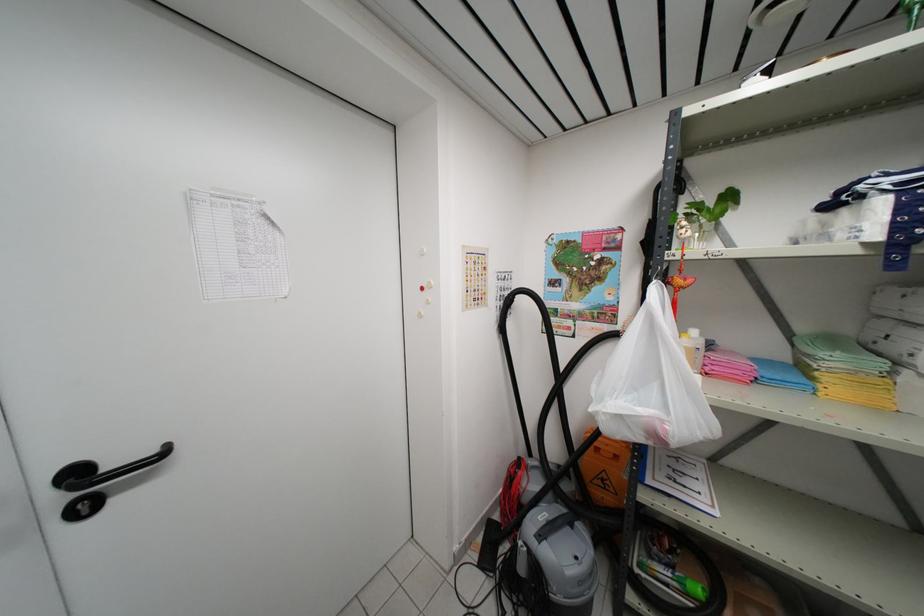
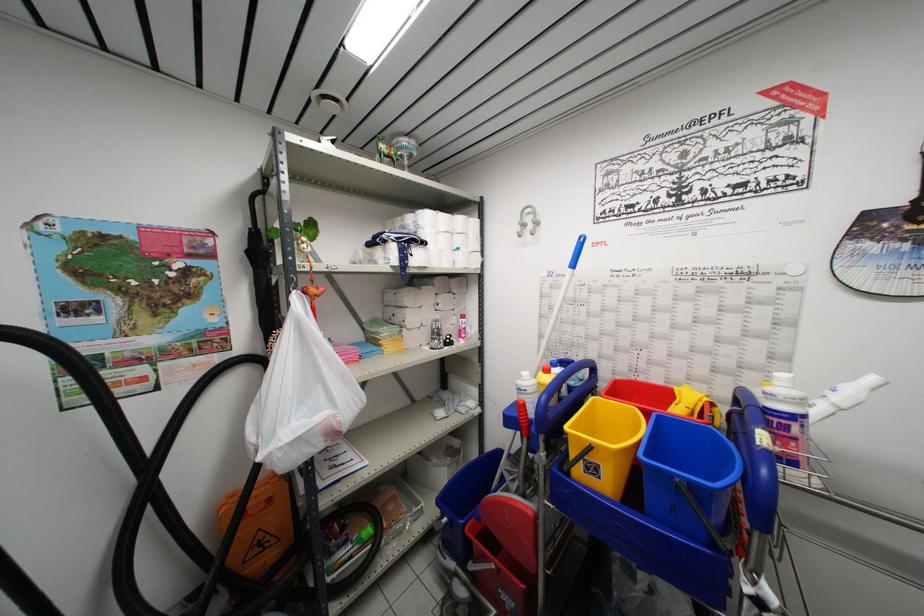
In the second image, find the point that corresponds to [670,435] in the first image.

(342, 427)